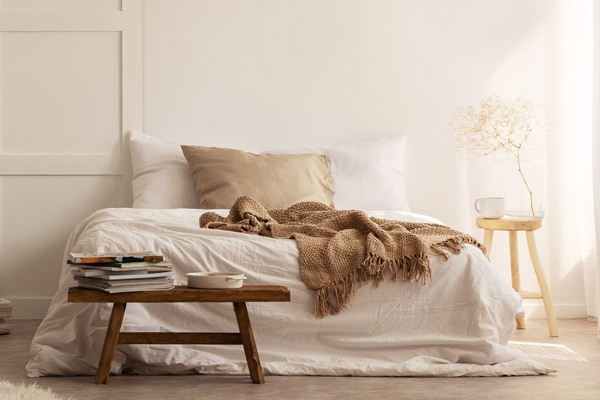
In order to click on wall design in this screenshot , I will do `click(78, 159)`.